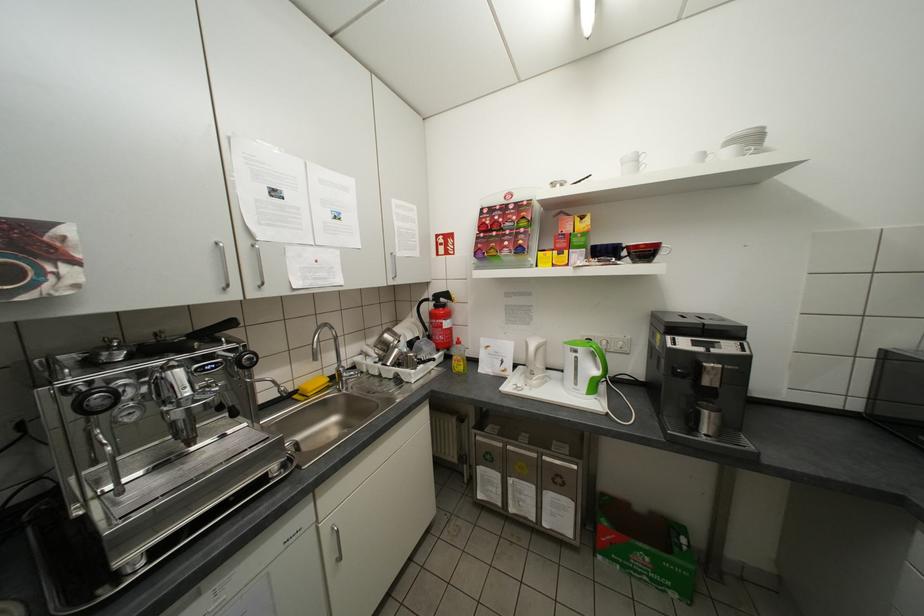
The image size is (924, 616). I want to click on fire extinguisher handle, so [436, 318].